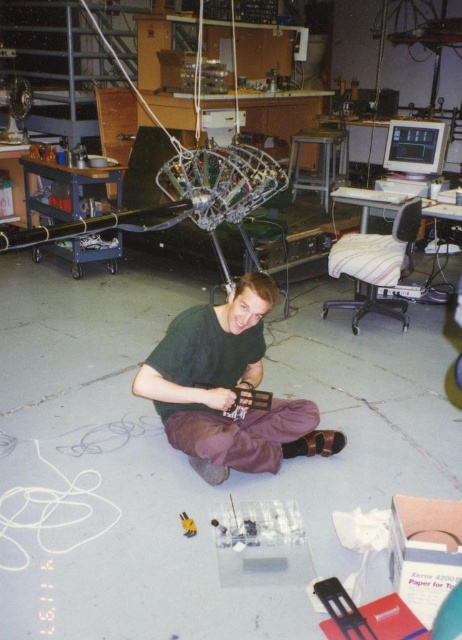
You are standing in the laboratory and want to reach a point that is exactly 2.62 meters away from your current position. Can you confirm if the point at coordinates point(274, 426) is exactly 2.62 meters away from you?

Yes, the point at coordinates point(274, 426) is exactly 2.62 meters away from the camera, so it is the correct point to reach.

In the scene shown: What is located at the coordinates point (226, 388) in the image?

The green matte shirt at center is located at point (226, 388).